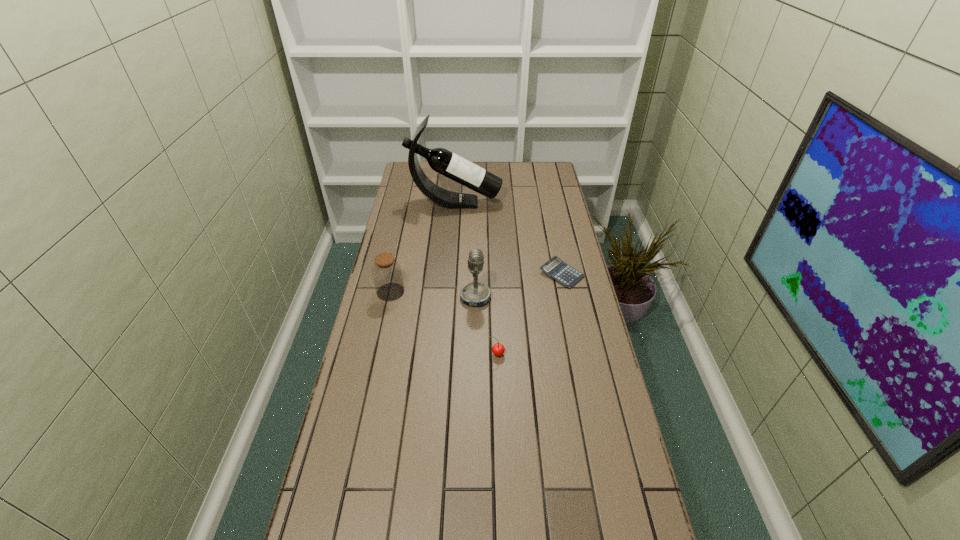
Identify the location of the tallest object. (441, 160).

Locate an element on the screen. wine bottle is located at coordinates (441, 160).

At what (x,y) coordinates should I click in order to perform the action: click on the second tallest object. Please return your answer as a coordinate pair (x, y). This screenshot has width=960, height=540. Looking at the image, I should click on (475, 293).

This screenshot has width=960, height=540. Find the location of `jar`. jar is located at coordinates (386, 271).

At what (x,y) coordinates should I click in order to perform the action: click on cherry. Please return your answer as a coordinate pair (x, y). This screenshot has height=540, width=960. Looking at the image, I should click on (498, 349).

Locate an element on the screen. The image size is (960, 540). the nearest object is located at coordinates (498, 349).

You are a GUI agent. You are given a task and a screenshot of the screen. Output one action in this format:
    pyautogui.click(x=<x>, y=<y>)
    Task: Click on the calculator
    
    Given the screenshot: What is the action you would take?
    pyautogui.click(x=555, y=268)

Locate an element on the screen. The width and height of the screenshot is (960, 540). the shortest object is located at coordinates (555, 268).

You are a GUI agent. You are given a task and a screenshot of the screen. Output one action in this format:
    pyautogui.click(x=<x>, y=<y>)
    Task: Click on the free space located on the stand of the farthest object
    
    Given the screenshot: What is the action you would take?
    pyautogui.click(x=531, y=202)

Where is `vacant space located on the front-facing side of the microphone`? vacant space located on the front-facing side of the microphone is located at coordinates [525, 298].